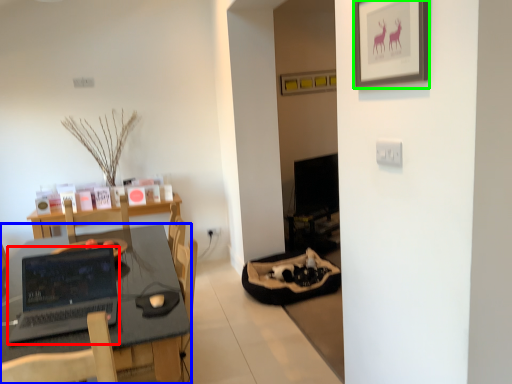
Question: Estimate the real-world distances between objects in this image. Which object is farther from laptop (highlighted by a red box), desk (highlighted by a blue box) or picture frame (highlighted by a green box)?

Choices:
 (A) desk
 (B) picture frame

Answer: (B)